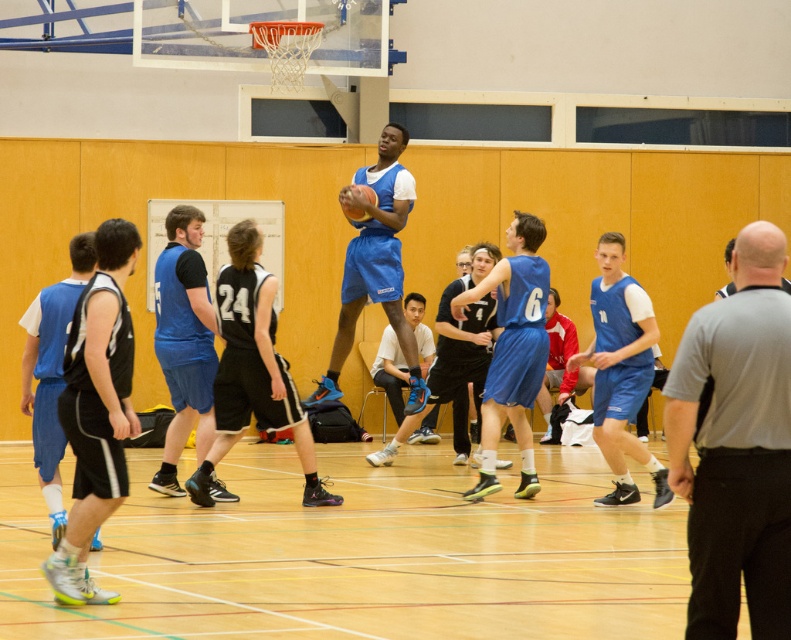
You are a referee observing the basketball game. You notice the light gray fabric shirt at center and the glossy blue basketball at center. Which object is higher in position?

The light gray fabric shirt at center is taller than the glossy blue basketball at center.

You are a referee observing the game. You notice two players, one wearing matte black shorts at left and another in matte blue jersey at right. Which player is closer to the basketball hoop mounted on the wall at the back?

The matte black shorts at left is positioned under matte blue jersey at right, so the matte blue jersey at right is closer to the basketball hoop mounted on the wall at the back.

You are a referee observing the basketball game. You need to determine if the light gray fabric shirt at center is wider than the glossy blue basketball at center. Based on the scene, can you confirm this?

The light gray fabric shirt at center might be wider than the glossy blue basketball at center, so it is possible that the shirt is wider, but the exact measurement is uncertain.